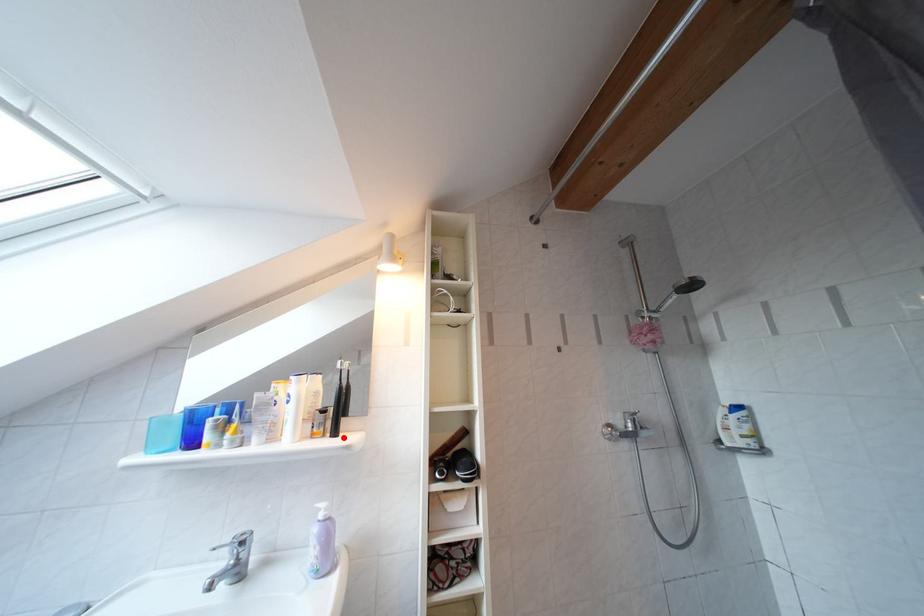
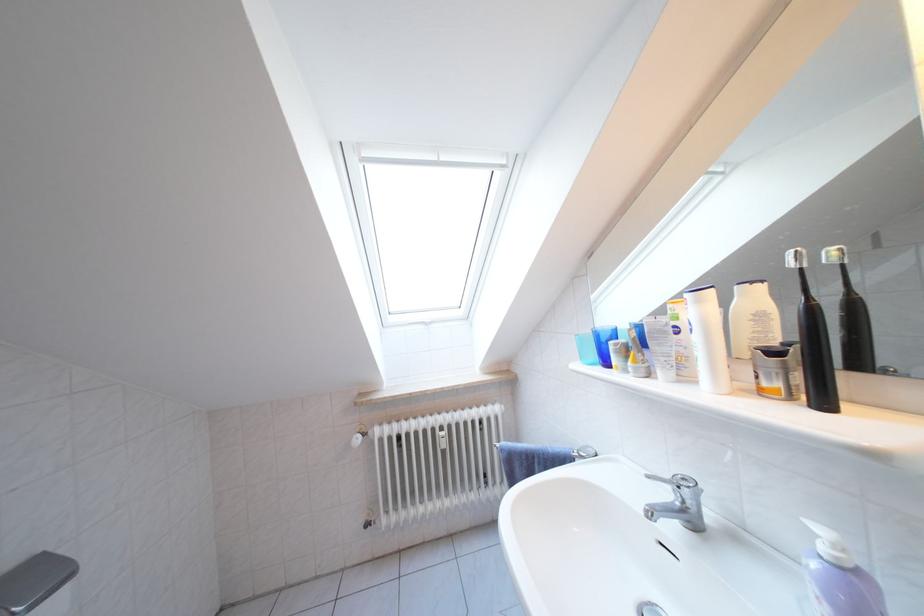
The point at the highlighted location is marked in the first image. Where is the corresponding point in the second image?

(833, 407)